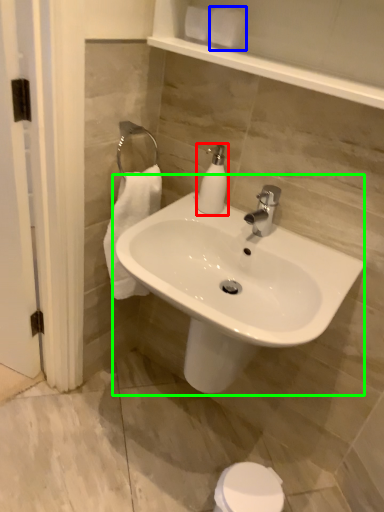
Question: Based on their relative distances, which object is nearer to soap dispenser (highlighted by a red box)? Choose from toilet paper (highlighted by a blue box) and sink (highlighted by a green box).

Choices:
 (A) toilet paper
 (B) sink

Answer: (B)